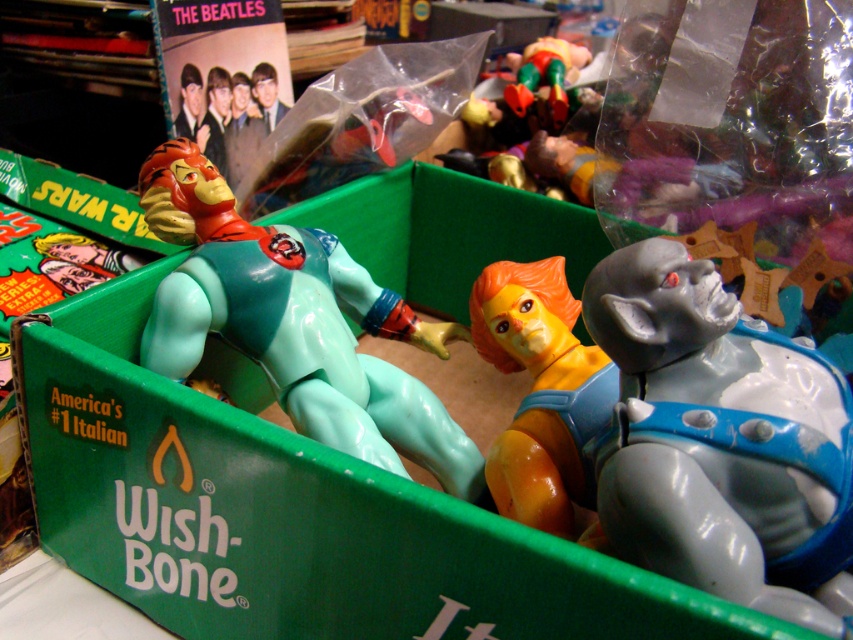
You are organizing a toy collection and need to stack the orange matte figure at center and the shiny metallic figure at upper center vertically. Which one should you place at the bottom to ensure stability?

The orange matte figure at center should be placed at the bottom since it is taller than the shiny metallic figure at upper center, providing a more stable base.

You are organizing a toy collection and need to place the light blue plastic figure at center and the shiny metallic figure at upper center into a storage container. Which of the two figures will require more space in the container due to its size?

The light blue plastic figure at center requires more space in the container because it has a larger size compared to the shiny metallic figure at upper center.